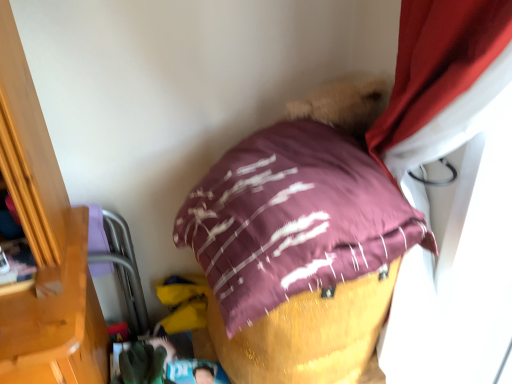
The image size is (512, 384). I want to click on purple fabric bean bag at left, so click(x=124, y=268).

What do you see at coordinates (124, 268) in the screenshot? Image resolution: width=512 pixels, height=384 pixels. I see `purple fabric bean bag at left` at bounding box center [124, 268].

This screenshot has height=384, width=512. What are the coordinates of `purple fabric bean bag at left` in the screenshot? It's located at (124, 268).

Is maroon satin pillow at center bigger than purple fabric bean bag at left?

Yes.

Are maroon satin pillow at center and purple fabric bean bag at left beside each other?

maroon satin pillow at center and purple fabric bean bag at left are not in contact.

Is maroon satin pillow at center closer to the viewer compared to purple fabric bean bag at left?

That is True.

Which is behind, point (230, 210) or point (139, 374)?

Positioned behind is point (139, 374).

Measure the distance between maroon satin pillow at center and green fabric glove at lower center.

59.47 centimeters.

What's the angular difference between maroon satin pillow at center and green fabric glove at lower center's facing directions?

They differ by 1.31 degrees in their facing directions.

Could you tell me if maroon satin pillow at center is turned towards green fabric glove at lower center?

No, maroon satin pillow at center is not turned towards green fabric glove at lower center.

Can we say green fabric glove at lower center lies outside purple fabric bean bag at left?

Indeed, green fabric glove at lower center is completely outside purple fabric bean bag at left.

Between green fabric glove at lower center and purple fabric bean bag at left, which one is positioned in front?

Positioned in front is green fabric glove at lower center.

Is green fabric glove at lower center looking in the opposite direction of purple fabric bean bag at left?

That's right, green fabric glove at lower center is facing away from purple fabric bean bag at left.

Is green fabric glove at lower center positioned far away from purple fabric bean bag at left?

No, there isn't a large distance between green fabric glove at lower center and purple fabric bean bag at left.

Does green fabric glove at lower center have a larger size compared to maroon satin pillow at center?

No, green fabric glove at lower center is not bigger than maroon satin pillow at center.

Can you confirm if green fabric glove at lower center is wider than maroon satin pillow at center?

No, green fabric glove at lower center is not wider than maroon satin pillow at center.

Is maroon satin pillow at center completely or partially inside green fabric glove at lower center?

No.

From the image's perspective, is green fabric glove at lower center positioned above or below maroon satin pillow at center?

Clearly, from the image's perspective, green fabric glove at lower center is below maroon satin pillow at center.

Is purple fabric bean bag at left facing towards maroon satin pillow at center?

No, purple fabric bean bag at left is not aimed at maroon satin pillow at center.

Would you say purple fabric bean bag at left is inside or outside maroon satin pillow at center?

purple fabric bean bag at left is not inside maroon satin pillow at center, it's outside.

How much distance is there between purple fabric bean bag at left and maroon satin pillow at center?

They are 23.23 inches apart.

Based on the photo, is purple fabric bean bag at left at the right side of maroon satin pillow at center?

In fact, purple fabric bean bag at left is to the left of maroon satin pillow at center.

Considering the positions of objects purple fabric bean bag at left and green fabric glove at lower center in the image provided, who is in front, purple fabric bean bag at left or green fabric glove at lower center?

green fabric glove at lower center is more forward.

Measure the distance from purple fabric bean bag at left to green fabric glove at lower center.

A distance of 9.49 inches exists between purple fabric bean bag at left and green fabric glove at lower center.

Between purple fabric bean bag at left and green fabric glove at lower center, which one appears on the left side from the viewer's perspective?

purple fabric bean bag at left is more to the left.

How different are the orientations of purple fabric bean bag at left and green fabric glove at lower center in degrees?

They differ by 0.0072 degrees in their facing directions.

In the image, there is a purple fabric bean bag at left. Find the location of `pillow above it (from the image's perspective)`. pillow above it (from the image's perspective) is located at coordinates (293, 218).

I want to click on clothing below the maroon satin pillow at center (from a real-world perspective), so click(x=142, y=365).

When comparing their distances from green fabric glove at lower center, does purple fabric bean bag at left or maroon satin pillow at center seem further?

The object further to green fabric glove at lower center is maroon satin pillow at center.

When comparing their distances from green fabric glove at lower center, does maroon satin pillow at center or purple fabric bean bag at left seem further?

Based on the image, maroon satin pillow at center appears to be further to green fabric glove at lower center.

Which object lies further to the anchor point purple fabric bean bag at left, maroon satin pillow at center or green fabric glove at lower center?

maroon satin pillow at center is further to purple fabric bean bag at left.

When comparing their distances from maroon satin pillow at center, does purple fabric bean bag at left or green fabric glove at lower center seem further?

green fabric glove at lower center is further to maroon satin pillow at center.

Looking at the image, which one is located further to purple fabric bean bag at left, green fabric glove at lower center or maroon satin pillow at center?

maroon satin pillow at center is positioned further to the anchor purple fabric bean bag at left.

Estimate the real-world distances between objects in this image. Which object is further from maroon satin pillow at center, green fabric glove at lower center or purple fabric bean bag at left?

Among the two, green fabric glove at lower center is located further to maroon satin pillow at center.

The image size is (512, 384). I want to click on clothing located between purple fabric bean bag at left and maroon satin pillow at center in the left-right direction, so click(x=142, y=365).